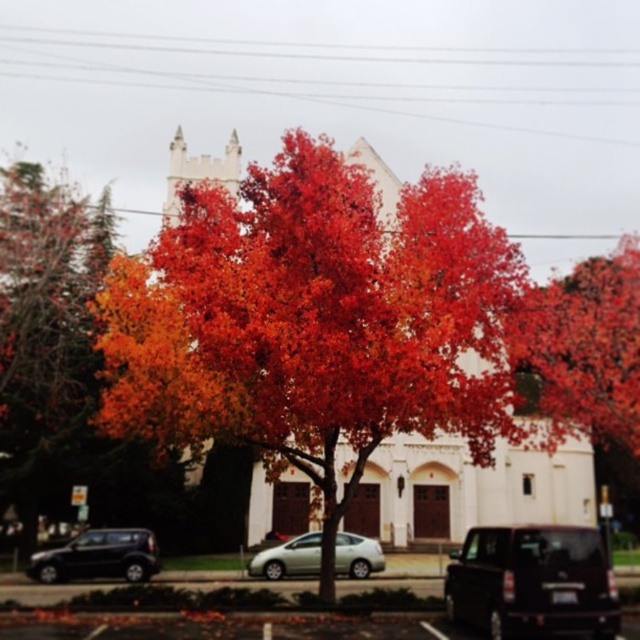
Question: Which point is closer to the camera?

Choices:
 (A) shiny red leaves at center
 (B) shiny black suv at lower left
 (C) metallic silver sedan at center
 (D) vivid orange leaves at center

Answer: (D)

Question: Which object is positioned closest to the shiny black suv at lower right?

Choices:
 (A) metallic silver sedan at center
 (B) vivid orange leaves at center

Answer: (A)

Question: Considering the real-world distances, which object is farthest from the metallic silver sedan at center?

Choices:
 (A) shiny orange leaves at left
 (B) shiny black suv at lower left

Answer: (A)

Question: Can you confirm if shiny orange leaves at left is wider than shiny black suv at lower left?

Choices:
 (A) yes
 (B) no

Answer: (A)

Question: Does shiny orange leaves at left come in front of shiny red leaves at center?

Choices:
 (A) no
 (B) yes

Answer: (A)

Question: Is shiny orange leaves at left positioned at the back of shiny black suv at lower right?

Choices:
 (A) yes
 (B) no

Answer: (A)